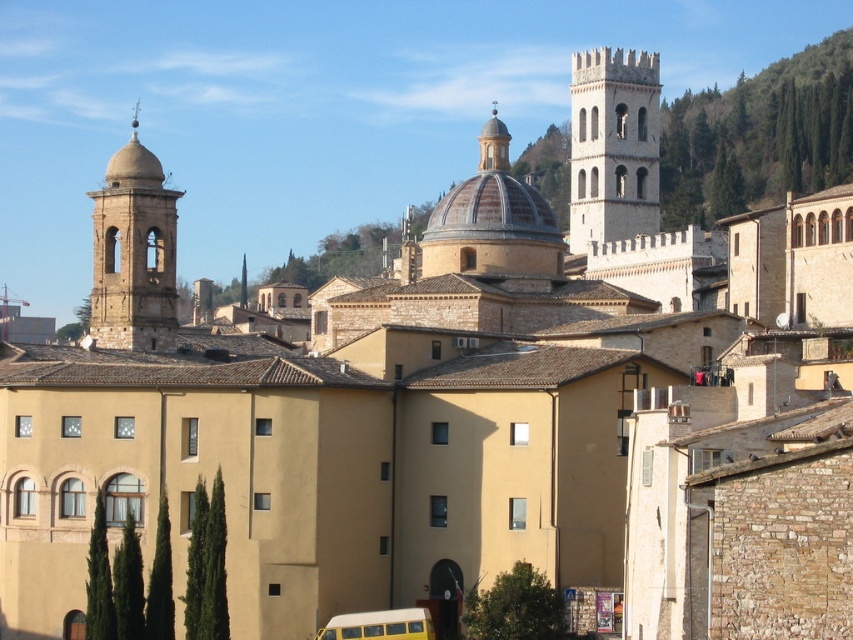
You are standing in the historic town and want to visit the stone tower at upper right. If you walk directly towards it, how far will you have to walk?

The stone tower at upper right is 187.56 meters away from the viewer, so you will have to walk 187.56 meters to reach it.

You are a tourist in this historic town and want to take a photo of the smooth stone bell tower at left and the yellow matte school bus at lower center. Which object should you zoom in on first to ensure it fits in the frame?

The smooth stone bell tower at left is bigger than the yellow matte school bus at lower center, so you should zoom in on the yellow matte school bus at lower center first to ensure it fits in the frame before adjusting for the larger tower.